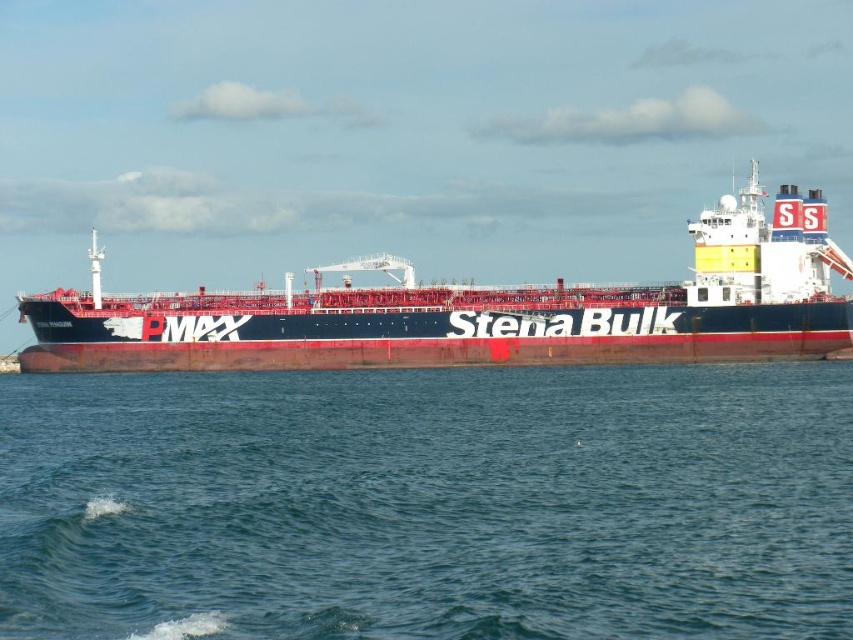
Image resolution: width=853 pixels, height=640 pixels. What do you see at coordinates (428, 502) in the screenshot?
I see `blue water at center` at bounding box center [428, 502].

The width and height of the screenshot is (853, 640). What do you see at coordinates (428, 502) in the screenshot?
I see `blue water at center` at bounding box center [428, 502].

Locate an element on the screen. Image resolution: width=853 pixels, height=640 pixels. blue water at center is located at coordinates (428, 502).